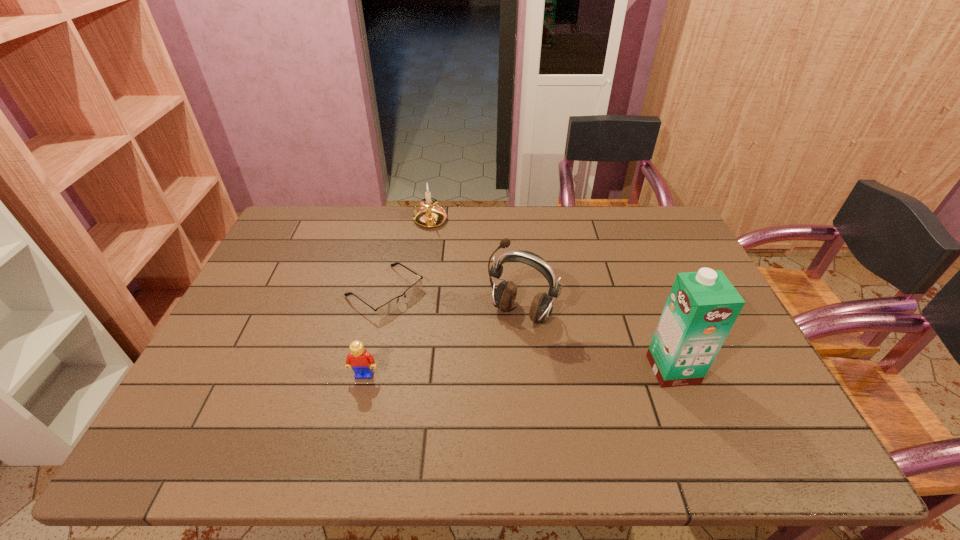
Where is `object that is at the right edge`? Image resolution: width=960 pixels, height=540 pixels. object that is at the right edge is located at coordinates [x=702, y=307].

The image size is (960, 540). Find the location of `object present at the near right corner`. object present at the near right corner is located at coordinates (702, 307).

Locate an element on the screen. blank space at the far edge is located at coordinates (389, 234).

This screenshot has height=540, width=960. What are the coordinates of `blank space at the near edge of the desktop` in the screenshot? It's located at (703, 409).

I want to click on vacant position at the left edge of the desktop, so click(x=294, y=272).

Find the location of `vacant space at the far left corner of the desktop`. vacant space at the far left corner of the desktop is located at coordinates (294, 206).

You are a GUI agent. You are given a task and a screenshot of the screen. Output one action in this format:
    pyautogui.click(x=<x>, y=<y>)
    Task: Click on the vacant space at the near left corner of the desktop
    
    Given the screenshot: What is the action you would take?
    pyautogui.click(x=226, y=390)

Where is `vacant point at the far right corner`? The width and height of the screenshot is (960, 540). vacant point at the far right corner is located at coordinates (659, 231).

In order to click on free space at the near right corner in this screenshot , I will do `click(748, 392)`.

Locate an element on the screen. empty space between the Lego and the earphone is located at coordinates (443, 344).